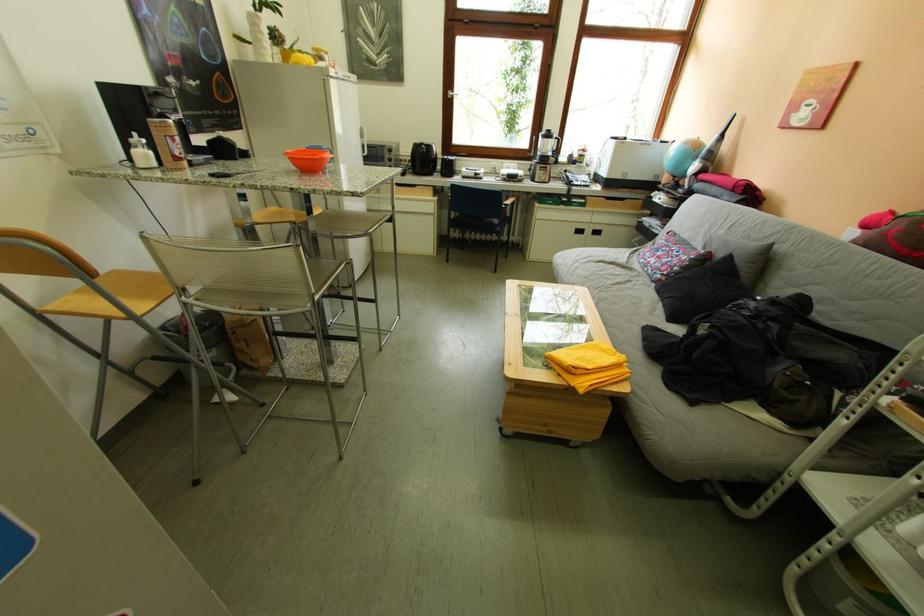
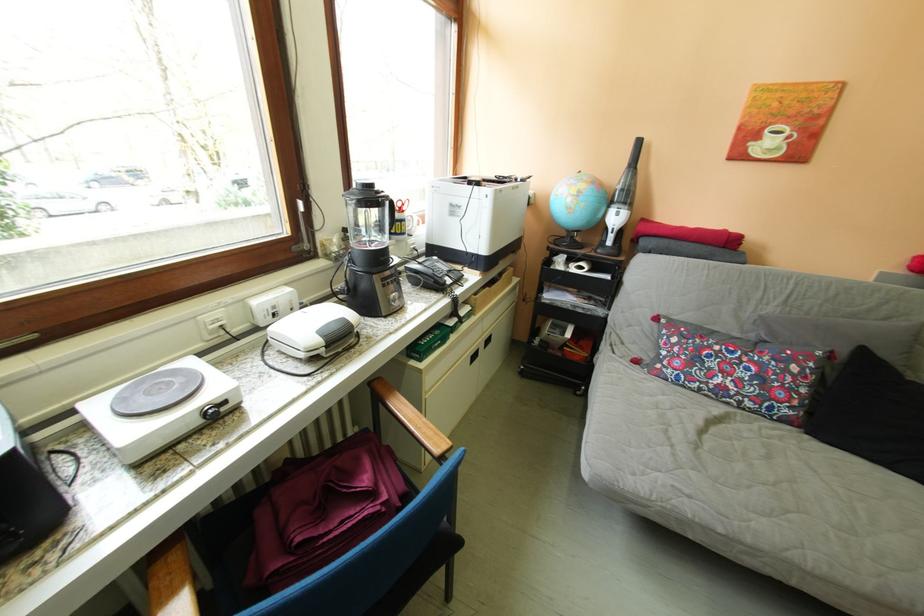
Locate, in the second image, the point that corresponds to point (669, 290) in the first image.

(821, 437)